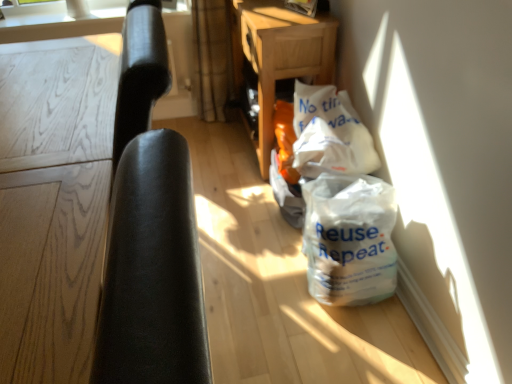
Image resolution: width=512 pixels, height=384 pixels. What do you see at coordinates (330, 133) in the screenshot? I see `white paper bag at center` at bounding box center [330, 133].

Where is `white paper bag at center`? This screenshot has height=384, width=512. white paper bag at center is located at coordinates (330, 133).

At what (x,y) coordinates should I click in order to perform the action: click on white matte plastic bag at lower right. Please return your answer as a coordinate pair (x, y). Looking at the image, I should click on (349, 239).

Based on the photo, considering the sizes of objects wooden at center and white matte plastic bag at lower right in the image provided, who is shorter, wooden at center or white matte plastic bag at lower right?

white matte plastic bag at lower right.

Choose the correct answer: Is wooden at center inside white matte plastic bag at lower right or outside it?

wooden at center is not inside white matte plastic bag at lower right, it's outside.

Which object is closer to the camera taking this photo, wooden at center or white matte plastic bag at lower right?

white matte plastic bag at lower right is closer to the camera.

Which point is more forward, (286, 39) or (332, 148)?

Positioned in front is point (332, 148).

Is wooden at center situated inside white paper bag at center or outside?

wooden at center is outside white paper bag at center.

From a real-world perspective, who is located higher, wooden at center or white paper bag at center?

From a 3D spatial view, white paper bag at center is above.

From the picture: Is white matte plastic bag at lower right far from black leather chair at left?

No, there isn't a large distance between white matte plastic bag at lower right and black leather chair at left.

From a real-world perspective, is white matte plastic bag at lower right positioned over black leather chair at left based on gravity?

No, from a real-world perspective, white matte plastic bag at lower right is not over black leather chair at left

Which object is positioned more to the left, white matte plastic bag at lower right or black leather chair at left?

black leather chair at left.

Considering the positions of point (386, 290) and point (178, 381), is point (386, 290) closer or farther from the camera than point (178, 381)?

Point (386, 290) is positioned farther from the camera compared to point (178, 381).

Can you confirm if black leather chair at left is taller than white matte plastic bag at lower right?

Indeed, black leather chair at left has a greater height compared to white matte plastic bag at lower right.

Considering the positions of objects black leather chair at left and white matte plastic bag at lower right in the image provided, who is more to the right, black leather chair at left or white matte plastic bag at lower right?

Positioned to the right is white matte plastic bag at lower right.

Would you say white matte plastic bag at lower right is part of black leather chair at left's contents?

No, white matte plastic bag at lower right is not surrounded by black leather chair at left.

From the image's perspective, does black leather chair at left appear lower than white matte plastic bag at lower right?

Incorrect, from the image's perspective, black leather chair at left is higher than white matte plastic bag at lower right.

Consider the image. Is wooden at center at the back of white matte plastic bag at lower right?

No, wooden at center is not at the back of white matte plastic bag at lower right.

Are white matte plastic bag at lower right and wooden at center making contact?

There is a gap between white matte plastic bag at lower right and wooden at center.

Which object is closer to the camera, white matte plastic bag at lower right or wooden at center?

white matte plastic bag at lower right is more forward.

Considering the positions of objects white paper bag at center and black leather chair at left in the image provided, who is in front, white paper bag at center or black leather chair at left?

black leather chair at left.

Does white paper bag at center have a lesser width compared to black leather chair at left?

Yes, white paper bag at center is thinner than black leather chair at left.

Can you confirm if white paper bag at center is positioned to the left of black leather chair at left?

Incorrect, white paper bag at center is not on the left side of black leather chair at left.

Is white paper bag at center turned away from black leather chair at left?

No, white paper bag at center's orientation is not away from black leather chair at left.

Considering the positions of objects white matte plastic bag at lower right and white paper bag at center in the image provided, who is in front, white matte plastic bag at lower right or white paper bag at center?

white matte plastic bag at lower right is more forward.

Is white matte plastic bag at lower right not within white paper bag at center?

Yes, white matte plastic bag at lower right is outside of white paper bag at center.

Is white matte plastic bag at lower right with white paper bag at center?

white matte plastic bag at lower right and white paper bag at center are clearly separated.

In the scene shown: Considering the sizes of objects white matte plastic bag at lower right and white paper bag at center in the image provided, who is wider, white matte plastic bag at lower right or white paper bag at center?

white matte plastic bag at lower right is wider.

You are a GUI agent. You are given a task and a screenshot of the screen. Output one action in this format:
    pyautogui.click(x=<x>, y=<y>)
    Task: Click on the plastic bag on the right side of wooden at center
    This screenshot has height=384, width=512.
    Given the screenshot: What is the action you would take?
    pyautogui.click(x=349, y=239)

Locate an element on the screen. This screenshot has width=512, height=384. grocery bag positioned vertically above the wooden at center (from a real-world perspective) is located at coordinates (330, 133).

Which object lies further to the anchor point black leather chair at left, white matte plastic bag at lower right or wooden at center?

The object further to black leather chair at left is wooden at center.

Which object lies nearer to the anchor point white paper bag at center, white matte plastic bag at lower right or wooden at center?

white matte plastic bag at lower right.

Considering their positions, is white paper bag at center positioned further to wooden at center than white matte plastic bag at lower right?

Answer: Among the two, white matte plastic bag at lower right is located further to wooden at center.

Looking at the image, which one is located closer to white paper bag at center, black leather chair at left or white matte plastic bag at lower right?

white matte plastic bag at lower right is positioned closer to the anchor white paper bag at center.

From the image, which object appears to be nearer to white matte plastic bag at lower right, white paper bag at center or black leather chair at left?

white paper bag at center is closer to white matte plastic bag at lower right.

From the image, which object appears to be nearer to white matte plastic bag at lower right, white paper bag at center or wooden at center?

white paper bag at center is positioned closer to the anchor white matte plastic bag at lower right.

Considering their positions, is black leather chair at left positioned further to white matte plastic bag at lower right than wooden at center?

black leather chair at left lies further to white matte plastic bag at lower right than the other object.

Looking at the image, which one is located further to white paper bag at center, white matte plastic bag at lower right or black leather chair at left?

black leather chair at left is further to white paper bag at center.

Find the location of `grocery bag between black leather chair at left and wooden at center in the front-back direction`. grocery bag between black leather chair at left and wooden at center in the front-back direction is located at coordinates (330, 133).

What are the coordinates of `plastic bag located between black leather chair at left and wooden at center in the depth direction` in the screenshot? It's located at (349, 239).

Where is `grocery bag that lies between wooden at center and white matte plastic bag at lower right from top to bottom`? grocery bag that lies between wooden at center and white matte plastic bag at lower right from top to bottom is located at coordinates (330, 133).

The height and width of the screenshot is (384, 512). I want to click on plastic bag between black leather chair at left and white paper bag at center from front to back, so click(349, 239).